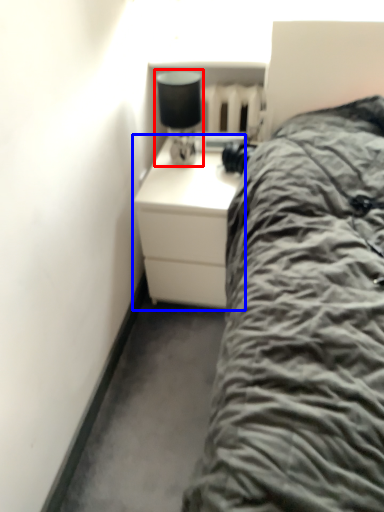
Question: Which point is further to the camera, bedside lamp (highlighted by a red box) or chest of drawers (highlighted by a blue box)?

Choices:
 (A) bedside lamp
 (B) chest of drawers

Answer: (B)